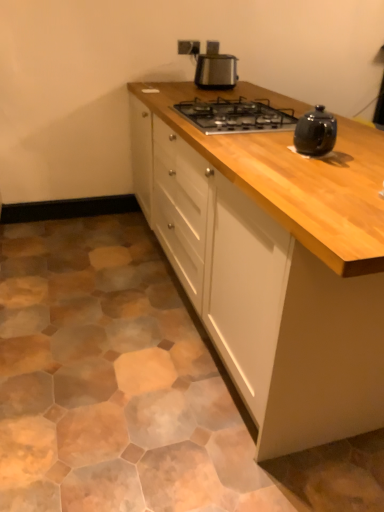
Question: Considering the relative sizes of white wood cabinet at center and satin metallic toaster at upper center in the image provided, is white wood cabinet at center thinner than satin metallic toaster at upper center?

Choices:
 (A) no
 (B) yes

Answer: (A)

Question: Can you confirm if white wood cabinet at center is taller than satin metallic toaster at upper center?

Choices:
 (A) yes
 (B) no

Answer: (A)

Question: From the image's perspective, would you say white wood cabinet at center is positioned over satin metallic toaster at upper center?

Choices:
 (A) yes
 (B) no

Answer: (B)

Question: Is white wood cabinet at center turned away from satin metallic toaster at upper center?

Choices:
 (A) yes
 (B) no

Answer: (B)

Question: Does white wood cabinet at center lie behind satin metallic toaster at upper center?

Choices:
 (A) yes
 (B) no

Answer: (B)

Question: Is white wood cabinet at center facing towards satin metallic toaster at upper center?

Choices:
 (A) no
 (B) yes

Answer: (A)

Question: Are black metal gas stove at center and satin metallic toaster at upper center far apart?

Choices:
 (A) yes
 (B) no

Answer: (B)

Question: Is black metal gas stove at center closer to the viewer compared to satin metallic toaster at upper center?

Choices:
 (A) yes
 (B) no

Answer: (A)

Question: Is black metal gas stove at center aimed at satin metallic toaster at upper center?

Choices:
 (A) yes
 (B) no

Answer: (B)

Question: Is black metal gas stove at center to the left of satin metallic toaster at upper center from the viewer's perspective?

Choices:
 (A) yes
 (B) no

Answer: (B)

Question: Does black metal gas stove at center have a greater height compared to satin metallic toaster at upper center?

Choices:
 (A) yes
 (B) no

Answer: (B)

Question: Does black metal gas stove at center contain satin metallic toaster at upper center?

Choices:
 (A) no
 (B) yes

Answer: (A)

Question: Can you confirm if black metal gas stove at center is shorter than white wood cabinet at center?

Choices:
 (A) yes
 (B) no

Answer: (A)